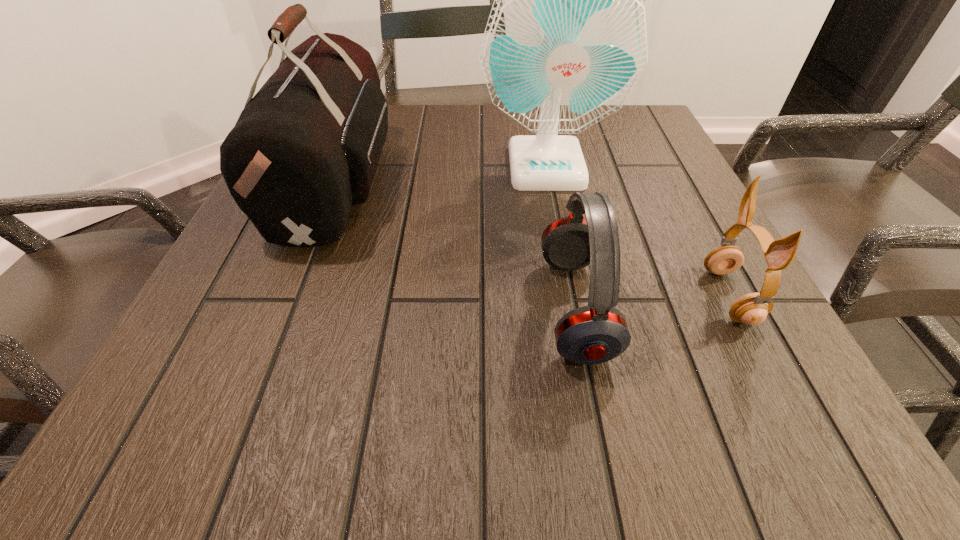
Find the location of a particular element. The width and height of the screenshot is (960, 540). vacant region located on the front-facing side of the rightmost object is located at coordinates (558, 296).

Identify the location of free location located 0.170m on the front-facing side of the rightmost object. Image resolution: width=960 pixels, height=540 pixels. (602, 296).

Locate an element on the screen. vacant area located 0.120m on the front-facing side of the rightmost object is located at coordinates (634, 296).

At what (x,y) coordinates should I click in order to perform the action: click on fan that is positioned at the far edge. Please return your answer as a coordinate pair (x, y). Image resolution: width=960 pixels, height=540 pixels. Looking at the image, I should click on (566, 40).

Image resolution: width=960 pixels, height=540 pixels. Find the location of `duffel bag that is at the far edge`. duffel bag that is at the far edge is located at coordinates (305, 148).

Find the location of a particular element. This screenshot has height=540, width=960. object that is positioned at the left edge is located at coordinates (305, 148).

Where is `fan that is at the right edge`? The image size is (960, 540). fan that is at the right edge is located at coordinates (566, 40).

At what (x,y) coordinates should I click in order to perform the action: click on earphone that is at the right edge. Please return your answer as a coordinate pair (x, y). The width and height of the screenshot is (960, 540). Looking at the image, I should click on (752, 309).

Identify the location of object positioned at the far left corner. The width and height of the screenshot is (960, 540). (305, 148).

Image resolution: width=960 pixels, height=540 pixels. Find the location of `object located in the far right corner section of the desktop`. object located in the far right corner section of the desktop is located at coordinates (566, 40).